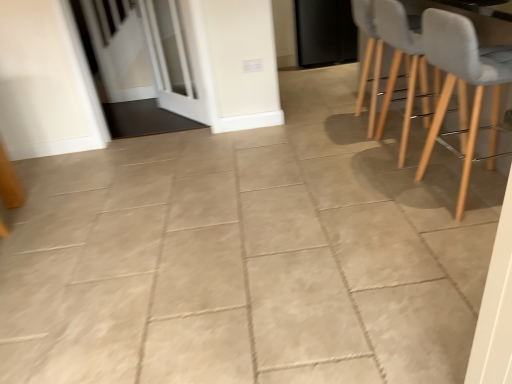
What do you see at coordinates (325, 32) in the screenshot? This screenshot has height=384, width=512. I see `black matte door at upper center` at bounding box center [325, 32].

Measure the distance between white glass screen door at upper left, which appears as the 2th screen door when viewed from the back, and camera.

white glass screen door at upper left, which appears as the 2th screen door when viewed from the back, and camera are 3.07 meters apart.

What do you see at coordinates (170, 60) in the screenshot? Image resolution: width=512 pixels, height=384 pixels. I see `white glass screen door at upper left, the 1th screen door in the front-to-back sequence` at bounding box center [170, 60].

Measure the distance between point (145,76) and camera.

Point (145,76) and camera are 13.78 feet apart from each other.

In order to face light gray fabric chair at right, the 1th chair in the front-to-back sequence, should I rotate leftwards or rightwards?

A 27.700 degree turn to the right will do.

At what (x,y) coordinates should I click in order to perform the action: click on light gray fabric chair at right, which appears as the 2th chair when viewed from the back. Please return your answer as a coordinate pair (x, y). Looking at the image, I should click on (464, 83).

Locate an element on the screen. This screenshot has width=512, height=384. light gray fabric chair at right, which is the 1th chair in back-to-front order is located at coordinates point(368,56).

Is light gray fabric chair at upper right inside the boundaries of white glossy screen door at upper left, the first screen door positioned from the back, or outside?

light gray fabric chair at upper right lies outside white glossy screen door at upper left, the first screen door positioned from the back.

Which is closer to the camera, (391, 66) or (183, 93)?

Point (391, 66).

From the image's perspective, would you say light gray fabric chair at upper right is positioned over white glossy screen door at upper left, the 2th screen door viewed from the front?

No, from the image's perspective, light gray fabric chair at upper right is not over white glossy screen door at upper left, the 2th screen door viewed from the front.

Which object is more forward, light gray fabric chair at upper right or white glossy screen door at upper left, the 2th screen door viewed from the front?

light gray fabric chair at upper right.

Does light gray fabric chair at right, which appears as the 2th chair when viewed from the back, appear on the right side of white glass screen door at upper left, which appears as the 2th screen door when viewed from the back?

Yes, light gray fabric chair at right, which appears as the 2th chair when viewed from the back, is to the right of white glass screen door at upper left, which appears as the 2th screen door when viewed from the back.

Looking at this image, from a real-world perspective, is light gray fabric chair at right, which appears as the 2th chair when viewed from the back, below white glass screen door at upper left, the 1th screen door in the front-to-back sequence?

Incorrect, from a real-world perspective, light gray fabric chair at right, which appears as the 2th chair when viewed from the back, is higher than white glass screen door at upper left, the 1th screen door in the front-to-back sequence.

Which point is more forward, (163, 81) or (453, 20)?

The point (453, 20) is closer to the camera.

From a real-world perspective, who is located higher, white glass screen door at upper left, the 1th screen door in the front-to-back sequence, or light gray fabric chair at right, which appears as the 2th chair when viewed from the back?

light gray fabric chair at right, which appears as the 2th chair when viewed from the back, is physically above.

In the scene shown: Would you consider white glass screen door at upper left, the 1th screen door in the front-to-back sequence, to be distant from light gray fabric chair at right, the 1th chair in the front-to-back sequence?

Yes, white glass screen door at upper left, the 1th screen door in the front-to-back sequence, is far from light gray fabric chair at right, the 1th chair in the front-to-back sequence.

Based on the photo, from their relative heights in the image, would you say white glass screen door at upper left, which appears as the 2th screen door when viewed from the back, is taller or shorter than light gray fabric chair at right, which appears as the 2th chair when viewed from the back?

Clearly, white glass screen door at upper left, which appears as the 2th screen door when viewed from the back, is taller compared to light gray fabric chair at right, which appears as the 2th chair when viewed from the back.

Can you confirm if light gray fabric chair at right, marked as the second chair in a front-to-back arrangement, is wider than white glossy screen door at upper left, the first screen door positioned from the back?

Yes, light gray fabric chair at right, marked as the second chair in a front-to-back arrangement, is wider than white glossy screen door at upper left, the first screen door positioned from the back.

Is light gray fabric chair at right, which is the 1th chair in back-to-front order, inside or outside of white glossy screen door at upper left, the first screen door positioned from the back?

light gray fabric chair at right, which is the 1th chair in back-to-front order, is outside white glossy screen door at upper left, the first screen door positioned from the back.

From a real-world perspective, is light gray fabric chair at right, which is the 1th chair in back-to-front order, positioned under white glossy screen door at upper left, the 2th screen door viewed from the front, based on gravity?

Yes, from a real-world perspective, light gray fabric chair at right, which is the 1th chair in back-to-front order, is below white glossy screen door at upper left, the 2th screen door viewed from the front.

Is light gray fabric chair at right, which is the 1th chair in back-to-front order, looking in the opposite direction of white glossy screen door at upper left, the 2th screen door viewed from the front?

light gray fabric chair at right, which is the 1th chair in back-to-front order, does not have its back to white glossy screen door at upper left, the 2th screen door viewed from the front.

From the image's perspective, is white glass screen door at upper left, which appears as the 2th screen door when viewed from the back, above or below black matte door at upper center?

From the image's perspective, white glass screen door at upper left, which appears as the 2th screen door when viewed from the back, appears below black matte door at upper center.

Considering the positions of point (146, 34) and point (349, 22), is point (146, 34) closer or farther from the camera than point (349, 22)?

Clearly, point (146, 34) is closer to the camera than point (349, 22).

Looking at this image, is white glass screen door at upper left, the 1th screen door in the front-to-back sequence, next to black matte door at upper center?

No, white glass screen door at upper left, the 1th screen door in the front-to-back sequence, is not in contact with black matte door at upper center.

Which of these two, white glass screen door at upper left, which appears as the 2th screen door when viewed from the back, or black matte door at upper center, is thinner?

white glass screen door at upper left, which appears as the 2th screen door when viewed from the back, is thinner.

Is light gray fabric chair at right, which appears as the 2th chair when viewed from the back, bigger or smaller than white glossy screen door at upper left, the first screen door positioned from the back?

In the image, light gray fabric chair at right, which appears as the 2th chair when viewed from the back, appears to be larger than white glossy screen door at upper left, the first screen door positioned from the back.

Is light gray fabric chair at right, which appears as the 2th chair when viewed from the back, shorter than white glossy screen door at upper left, the 2th screen door viewed from the front?

Yes.

From a real-world perspective, does light gray fabric chair at right, the 1th chair in the front-to-back sequence, sit lower than white glossy screen door at upper left, the first screen door positioned from the back?

Correct, in the physical world, light gray fabric chair at right, the 1th chair in the front-to-back sequence, is lower than white glossy screen door at upper left, the first screen door positioned from the back.

Could you tell me if light gray fabric chair at right, the 1th chair in the front-to-back sequence, is turned towards white glossy screen door at upper left, the first screen door positioned from the back?

No.

Is light gray fabric chair at right, which appears as the 2th chair when viewed from the back, facing away from light gray fabric chair at right, which is the 1th chair in back-to-front order?

light gray fabric chair at right, which appears as the 2th chair when viewed from the back, is not turned away from light gray fabric chair at right, which is the 1th chair in back-to-front order.

Is light gray fabric chair at right, which appears as the 2th chair when viewed from the back, far from light gray fabric chair at right, which is the 1th chair in back-to-front order?

light gray fabric chair at right, which appears as the 2th chair when viewed from the back, is actually quite close to light gray fabric chair at right, which is the 1th chair in back-to-front order.

Considering the sizes of objects light gray fabric chair at right, the 1th chair in the front-to-back sequence, and light gray fabric chair at right, marked as the second chair in a front-to-back arrangement, in the image provided, who is wider, light gray fabric chair at right, the 1th chair in the front-to-back sequence, or light gray fabric chair at right, marked as the second chair in a front-to-back arrangement,?

Wider between the two is light gray fabric chair at right, marked as the second chair in a front-to-back arrangement.

The height and width of the screenshot is (384, 512). What are the coordinates of `the 2nd screen door positioned above the light gray fabric chair at upper right (from the image's perspective)` in the screenshot? It's located at (145, 58).

Image resolution: width=512 pixels, height=384 pixels. I want to click on the 2nd chair in front when counting from the white glass screen door at upper left, the 1th screen door in the front-to-back sequence, so click(464, 83).

From the image, which object appears to be farther from black matte door at upper center, white glossy screen door at upper left, the 2th screen door viewed from the front, or light gray fabric chair at right, which appears as the 2th chair when viewed from the back?

light gray fabric chair at right, which appears as the 2th chair when viewed from the back, is further to black matte door at upper center.

Based on their spatial positions, is light gray fabric chair at right, which appears as the 2th chair when viewed from the back, or light gray fabric chair at upper right further from light gray fabric chair at right, marked as the second chair in a front-to-back arrangement?

light gray fabric chair at right, which appears as the 2th chair when viewed from the back.

Estimate the real-world distances between objects in this image. Which object is further from black matte door at upper center, white glossy screen door at upper left, the first screen door positioned from the back, or light gray fabric chair at right, marked as the second chair in a front-to-back arrangement?

white glossy screen door at upper left, the first screen door positioned from the back.

Estimate the real-world distances between objects in this image. Which object is closer to light gray fabric chair at upper right, black matte door at upper center or white glass screen door at upper left, the 1th screen door in the front-to-back sequence?

Based on the image, white glass screen door at upper left, the 1th screen door in the front-to-back sequence, appears to be nearer to light gray fabric chair at upper right.

When comparing their distances from white glass screen door at upper left, the 1th screen door in the front-to-back sequence, does white glossy screen door at upper left, the 2th screen door viewed from the front, or light gray fabric chair at right, which is the 1th chair in back-to-front order, seem further?

Based on the image, light gray fabric chair at right, which is the 1th chair in back-to-front order, appears to be further to white glass screen door at upper left, the 1th screen door in the front-to-back sequence.

Estimate the real-world distances between objects in this image. Which object is closer to white glass screen door at upper left, the 1th screen door in the front-to-back sequence, light gray fabric chair at upper right or light gray fabric chair at right, marked as the second chair in a front-to-back arrangement?

light gray fabric chair at right, marked as the second chair in a front-to-back arrangement, is positioned closer to the anchor white glass screen door at upper left, the 1th screen door in the front-to-back sequence.

Estimate the real-world distances between objects in this image. Which object is further from white glossy screen door at upper left, the 2th screen door viewed from the front, light gray fabric chair at right, the 1th chair in the front-to-back sequence, or light gray fabric chair at right, marked as the second chair in a front-to-back arrangement?

light gray fabric chair at right, the 1th chair in the front-to-back sequence, is further to white glossy screen door at upper left, the 2th screen door viewed from the front.

Considering their positions, is light gray fabric chair at right, marked as the second chair in a front-to-back arrangement, positioned closer to light gray fabric chair at upper right than white glossy screen door at upper left, the 2th screen door viewed from the front?

Based on the image, light gray fabric chair at right, marked as the second chair in a front-to-back arrangement, appears to be nearer to light gray fabric chair at upper right.

Image resolution: width=512 pixels, height=384 pixels. Find the location of `armchair between white glossy screen door at upper left, the 2th screen door viewed from the front, and light gray fabric chair at right, which appears as the 2th chair when viewed from the back, from left to right`. armchair between white glossy screen door at upper left, the 2th screen door viewed from the front, and light gray fabric chair at right, which appears as the 2th chair when viewed from the back, from left to right is located at coordinates (399, 66).

This screenshot has width=512, height=384. In order to click on door between white glossy screen door at upper left, the first screen door positioned from the back, and light gray fabric chair at upper right in this screenshot , I will do `click(325, 32)`.

Identify the location of screen door between light gray fabric chair at right, which appears as the 2th chair when viewed from the back, and white glossy screen door at upper left, the 2th screen door viewed from the front, from front to back. click(x=170, y=60).

Identify the location of armchair between light gray fabric chair at right, the 1th chair in the front-to-back sequence, and light gray fabric chair at right, marked as the second chair in a front-to-back arrangement, along the z-axis. The height and width of the screenshot is (384, 512). (399, 66).